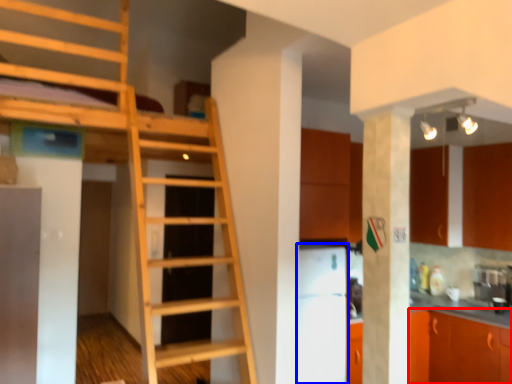
Question: Among these objects, which one is farthest to the camera, cabinetry (highlighted by a red box) or appliance (highlighted by a blue box)?

Choices:
 (A) cabinetry
 (B) appliance

Answer: (A)